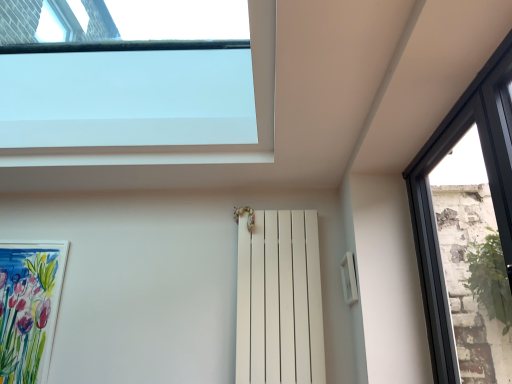
Question: Can you confirm if black glass window at right, marked as the 2th window in a left-to-right arrangement, is shorter than watercolor paper picture frame at lower left?

Choices:
 (A) yes
 (B) no

Answer: (B)

Question: Can you confirm if black glass window at right, which is counted as the 1th window, starting from the right, is bigger than watercolor paper picture frame at lower left?

Choices:
 (A) no
 (B) yes

Answer: (B)

Question: Can we say black glass window at right, marked as the 2th window in a left-to-right arrangement, lies outside watercolor paper picture frame at lower left?

Choices:
 (A) no
 (B) yes

Answer: (B)

Question: From a real-world perspective, is black glass window at right, which is counted as the 1th window, starting from the right, physically below watercolor paper picture frame at lower left?

Choices:
 (A) no
 (B) yes

Answer: (A)

Question: From the image's perspective, does black glass window at right, marked as the 2th window in a left-to-right arrangement, appear higher than watercolor paper picture frame at lower left?

Choices:
 (A) no
 (B) yes

Answer: (B)

Question: Does black glass window at right, marked as the 2th window in a left-to-right arrangement, come behind watercolor paper picture frame at lower left?

Choices:
 (A) no
 (B) yes

Answer: (A)

Question: Can you confirm if transparent glass window at upper center, the second window in the right-to-left sequence, is shorter than watercolor paper picture frame at lower left?

Choices:
 (A) no
 (B) yes

Answer: (B)

Question: Could you tell me if transparent glass window at upper center, which is counted as the 1th window, starting from the left, is facing watercolor paper picture frame at lower left?

Choices:
 (A) no
 (B) yes

Answer: (A)

Question: From the image's perspective, does transparent glass window at upper center, the second window in the right-to-left sequence, appear lower than watercolor paper picture frame at lower left?

Choices:
 (A) yes
 (B) no

Answer: (B)

Question: From the image's perspective, is transparent glass window at upper center, the second window in the right-to-left sequence, above watercolor paper picture frame at lower left?

Choices:
 (A) no
 (B) yes

Answer: (B)

Question: Can you confirm if transparent glass window at upper center, the second window in the right-to-left sequence, is thinner than watercolor paper picture frame at lower left?

Choices:
 (A) yes
 (B) no

Answer: (B)

Question: From a real-world perspective, is transparent glass window at upper center, the second window in the right-to-left sequence, positioned under watercolor paper picture frame at lower left based on gravity?

Choices:
 (A) no
 (B) yes

Answer: (A)

Question: Is white matte radiator at center shorter than watercolor paper picture frame at lower left?

Choices:
 (A) no
 (B) yes

Answer: (A)